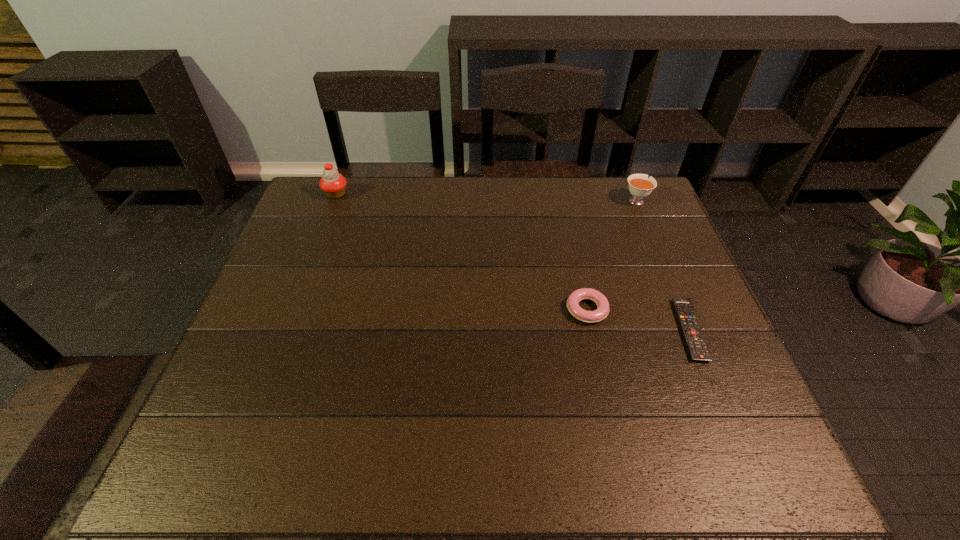
Locate an element on the screen. This screenshot has width=960, height=540. vacant space positioned on the left of the remote control is located at coordinates (569, 330).

The image size is (960, 540). What are the coordinates of `cupcake that is at the far edge` in the screenshot? It's located at (333, 184).

The image size is (960, 540). I want to click on teacup present at the far edge, so click(640, 186).

Where is `object present at the left edge`? The image size is (960, 540). object present at the left edge is located at coordinates (333, 184).

This screenshot has width=960, height=540. What are the coordinates of `teacup situated at the right edge` in the screenshot? It's located at (640, 186).

Identify the location of remote control that is at the right edge. The height and width of the screenshot is (540, 960). (698, 350).

This screenshot has width=960, height=540. I want to click on object that is positioned at the far left corner, so click(333, 184).

Where is `object that is at the far right corner`? The height and width of the screenshot is (540, 960). object that is at the far right corner is located at coordinates (640, 186).

Image resolution: width=960 pixels, height=540 pixels. Identify the location of free region at the far edge of the desktop. click(452, 185).

Identify the location of free space at the near edge of the desktop. Image resolution: width=960 pixels, height=540 pixels. (444, 451).